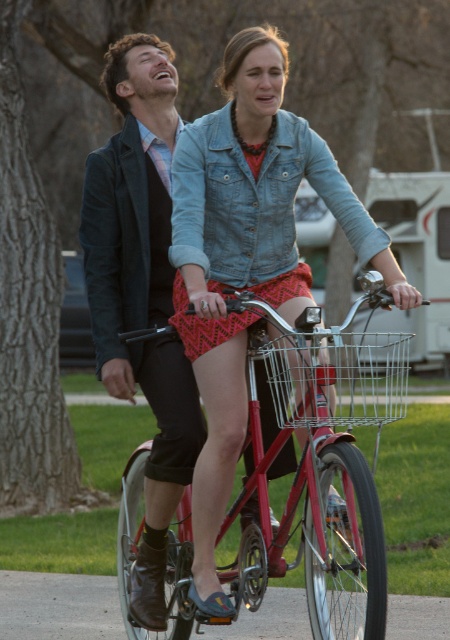
You are a photographer standing on the side of the path. You want to capture a photo of the metallic red bicycle at center and the denim jacket at center such that both are clearly visible. Given their sizes, which object should you focus on first to ensure it isn t cropped out of the frame?

The metallic red bicycle at center is much taller than the denim jacket at center, so you should focus on the metallic red bicycle at center first to ensure it isn t cropped out of the frame.

You are a delivery person needing to place a small package in the basket. Given the velvet black jacket at left and the wire mesh basket at center, which object can accommodate the package?

The wire mesh basket at center can accommodate the package since it is larger than the velvet black jacket at left.

You are standing on the paved path and want to reach the point marked at coordinates [169,368]. The bicycle is currently parked 37.49 feet away from you. If you start walking towards the point, will you need to move past the bicycle to reach it?

The point marked at coordinates [169,368] is 37.49 feet away from you, which is exactly where the bicycle is parked. Therefore, you are already at the location of the bicycle, so you don not need to move past it to reach the point.